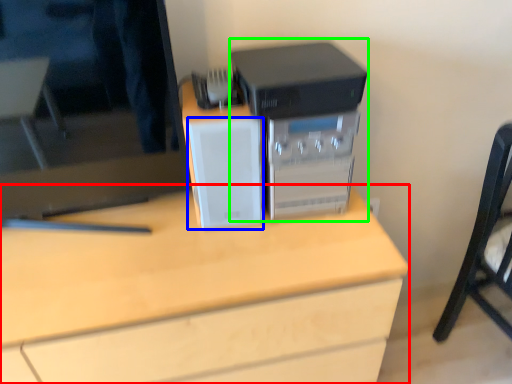
Question: Considering the real-world distances, which object is closest to desk (highlighted by a red box)? speaker (highlighted by a blue box) or home appliance (highlighted by a green box).

Choices:
 (A) speaker
 (B) home appliance

Answer: (A)